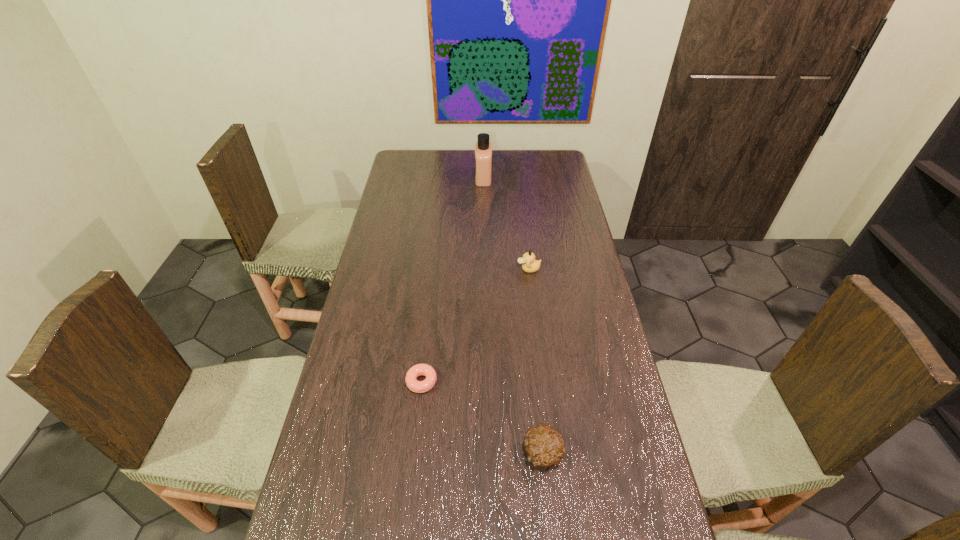
Image resolution: width=960 pixels, height=540 pixels. I want to click on object that is the third closest to the leftmost object, so click(x=483, y=149).

Where is `vacant space that satisfies the following two spatial constraints: 1. on the front label of the perfume; 2. on the left side of the second shortest object`? Image resolution: width=960 pixels, height=540 pixels. vacant space that satisfies the following two spatial constraints: 1. on the front label of the perfume; 2. on the left side of the second shortest object is located at coordinates (486, 453).

You are a GUI agent. You are given a task and a screenshot of the screen. Output one action in this format:
    pyautogui.click(x=<x>, y=<y>)
    Task: Click on the free region that satisfies the following two spatial constraints: 1. on the front label of the tallest object; 2. on the right side of the third tallest object
    The width and height of the screenshot is (960, 540).
    Given the screenshot: What is the action you would take?
    pyautogui.click(x=486, y=453)

The height and width of the screenshot is (540, 960). Identify the location of vacant region that satisfies the following two spatial constraints: 1. on the front label of the muffin; 2. on the right side of the tallest object. [x=486, y=453].